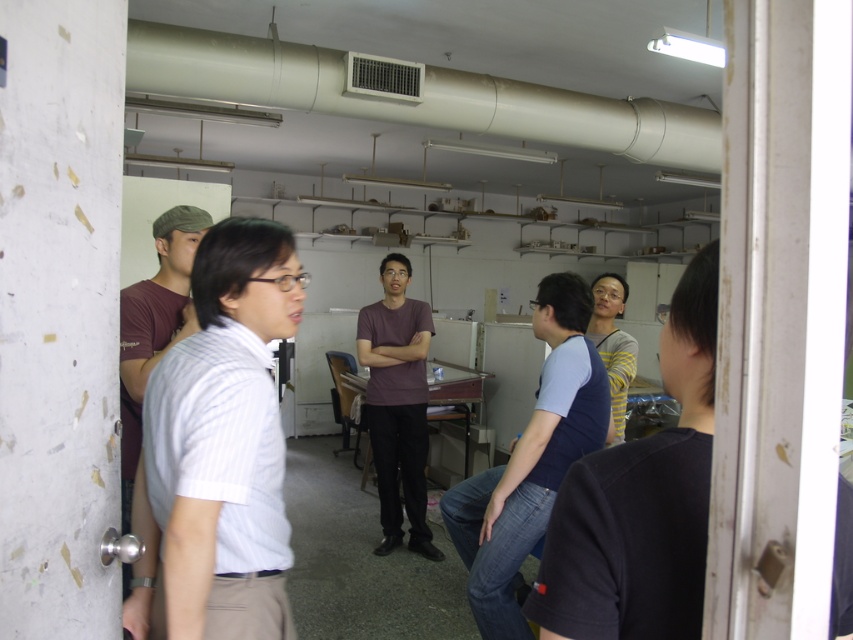
Question: Where is blue denim jeans at center located in relation to purple matte shirt at center in the image?

Choices:
 (A) above
 (B) below

Answer: (A)

Question: Is white striped shirt at left bigger than purple matte shirt at center?

Choices:
 (A) yes
 (B) no

Answer: (B)

Question: Is blue denim jeans at center below maroon cotton t-shirt at left?

Choices:
 (A) no
 (B) yes

Answer: (B)

Question: Which point is closer to the camera?

Choices:
 (A) (186, 310)
 (B) (166, 550)
 (C) (375, 356)

Answer: (B)

Question: Considering the real-world distances, which object is farthest from the white striped shirt at left?

Choices:
 (A) blue denim jeans at center
 (B) purple matte shirt at center
 (C) maroon cotton t-shirt at left

Answer: (B)

Question: Which object is the farthest from the white striped shirt at left?

Choices:
 (A) blue denim jeans at center
 (B) maroon cotton t-shirt at left
 (C) purple matte shirt at center

Answer: (C)